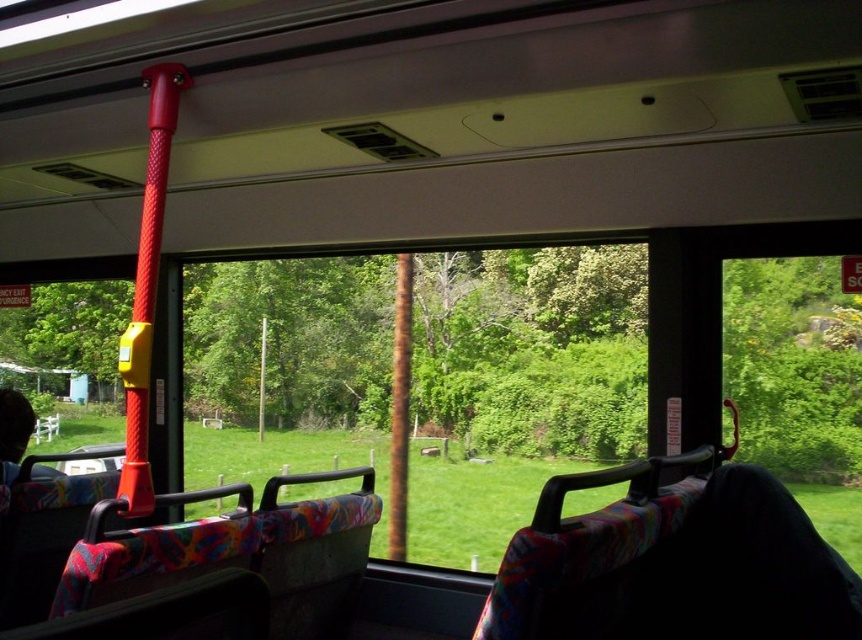
Can you confirm if green leafy tree at left is bigger than rusty metal pole at center?

Yes, green leafy tree at left is bigger than rusty metal pole at center.

Does green leafy tree at left appear on the right side of rusty metal pole at center?

No, green leafy tree at left is not to the right of rusty metal pole at center.

Looking at this image, who is more forward, (36, 298) or (392, 556)?

Positioned in front is point (392, 556).

I want to click on green leafy tree at left, so click(70, 332).